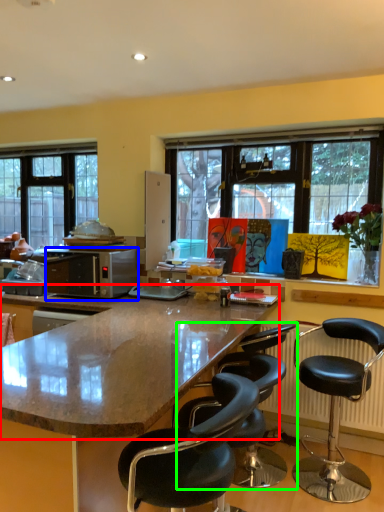
Question: Based on their relative distances, which object is nearer to countertop (highlighted by a red box)? Choose from microwave oven (highlighted by a blue box) and chair (highlighted by a green box).

Choices:
 (A) microwave oven
 (B) chair

Answer: (B)